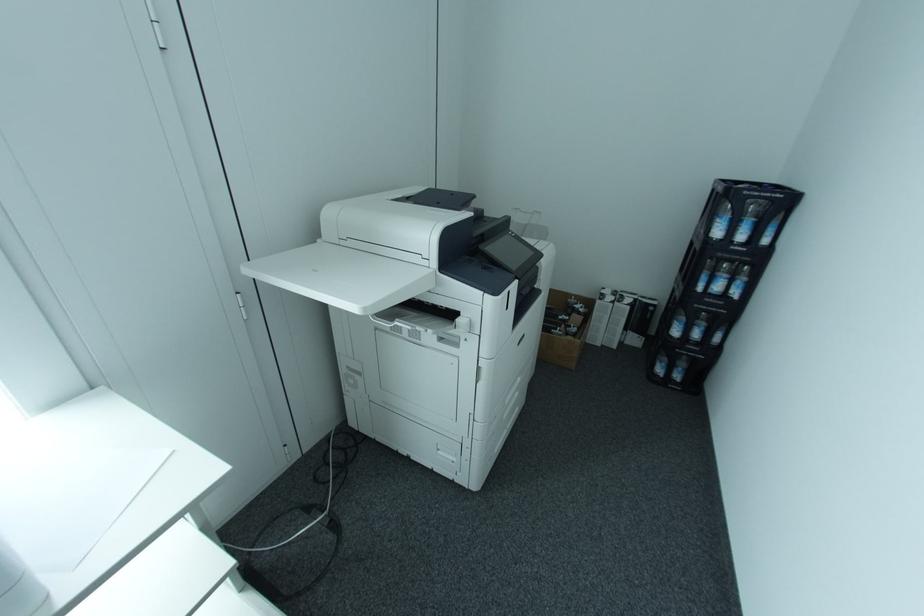
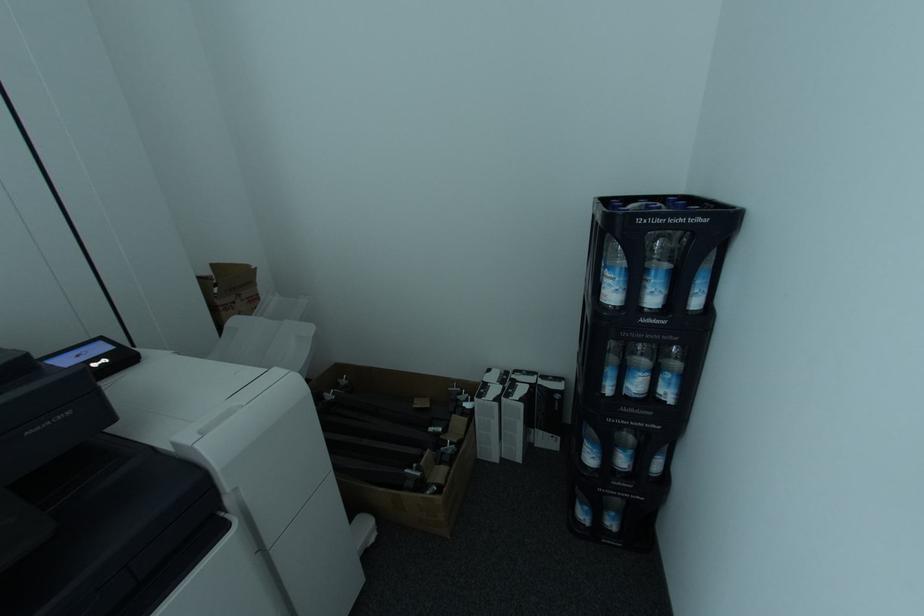
In a continuous first-person perspective shot, in which direction is the camera moving?

The cameraman moved toward right, forward.